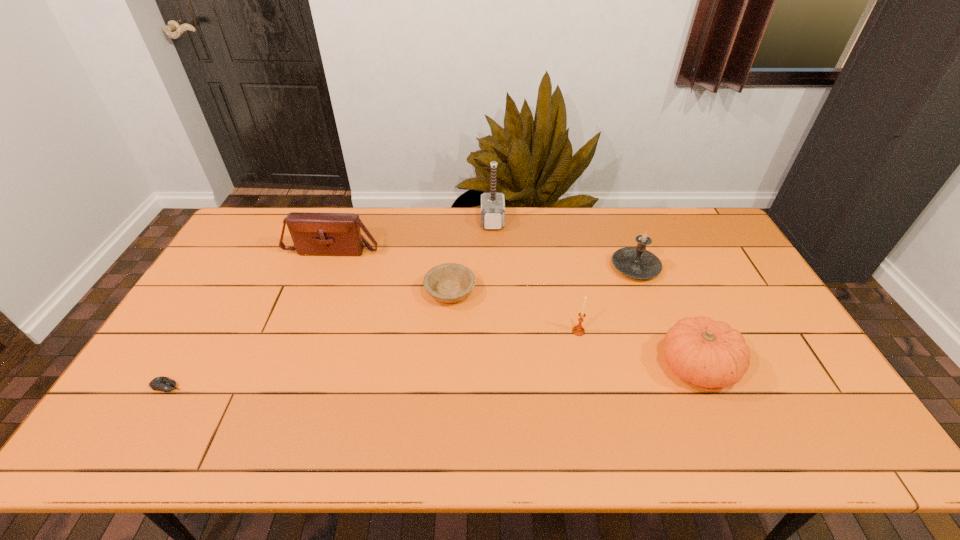
The image size is (960, 540). I want to click on vacant space that is in between the bowl and the second object from left to right, so click(392, 270).

Locate an element on the screen. The image size is (960, 540). vacant area that lies between the leftmost object and the pumpkin is located at coordinates (432, 376).

At what (x,y) coordinates should I click in order to perform the action: click on empty space between the shoulder bag and the second shortest object. Please return your answer as a coordinate pair (x, y). The height and width of the screenshot is (540, 960). Looking at the image, I should click on (392, 270).

Identify the location of vacant point located between the fifth farthest object and the fourth object from right to left. The image size is (960, 540). (536, 276).

Locate an element on the screen. The height and width of the screenshot is (540, 960). free point between the pumpkin and the candle is located at coordinates (666, 317).

I want to click on free spot between the second shortest object and the candle_holder, so click(x=515, y=312).

Find the location of a particular element. empty space that is in between the pumpkin and the fifth farthest object is located at coordinates (637, 349).

I want to click on free space that is in between the tallest object and the fifth farthest object, so click(536, 276).

At what (x,y) coordinates should I click in order to perform the action: click on the fifth closest object to the pumpkin. Please return your answer as a coordinate pair (x, y). This screenshot has width=960, height=540. Looking at the image, I should click on (322, 234).

Identify which object is the fifth nearest to the third object from right to left. Please provide its 2D coordinates. Your answer should be formatted as a tuple, i.e. [(x, y)], where the tuple contains the x and y coordinates of a point satisfying the conditions above.

[(322, 234)]